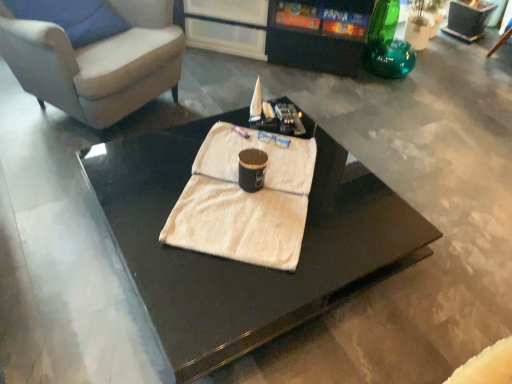
Question: From a real-world perspective, is white textured towel at center under suede-like beige armchair at upper left?

Choices:
 (A) yes
 (B) no

Answer: (A)

Question: Is white textured towel at center closer to the viewer compared to suede-like beige armchair at upper left?

Choices:
 (A) yes
 (B) no

Answer: (A)

Question: From the image's perspective, would you say white textured towel at center is shown under suede-like beige armchair at upper left?

Choices:
 (A) yes
 (B) no

Answer: (A)

Question: Is white textured towel at center oriented away from suede-like beige armchair at upper left?

Choices:
 (A) no
 (B) yes

Answer: (A)

Question: Is white textured towel at center positioned beyond the bounds of suede-like beige armchair at upper left?

Choices:
 (A) yes
 (B) no

Answer: (A)

Question: Considering the relative positions of white textured towel at center and black glossy entertainment center at upper center in the image provided, is white textured towel at center to the left or to the right of black glossy entertainment center at upper center?

Choices:
 (A) right
 (B) left

Answer: (B)

Question: Is point (272, 195) closer or farther from the camera than point (303, 54)?

Choices:
 (A) closer
 (B) farther

Answer: (A)

Question: Is white textured towel at center wider or thinner than black glossy entertainment center at upper center?

Choices:
 (A) thin
 (B) wide

Answer: (A)

Question: Considering the positions of white textured towel at center and black glossy entertainment center at upper center in the image, is white textured towel at center taller or shorter than black glossy entertainment center at upper center?

Choices:
 (A) tall
 (B) short

Answer: (B)

Question: Considering the relative positions of suede-like beige armchair at upper left and black glossy coffee table at center in the image provided, is suede-like beige armchair at upper left to the left or to the right of black glossy coffee table at center?

Choices:
 (A) right
 (B) left

Answer: (B)

Question: Is suede-like beige armchair at upper left taller or shorter than black glossy coffee table at center?

Choices:
 (A) tall
 (B) short

Answer: (A)

Question: In the image, is suede-like beige armchair at upper left positioned in front of or behind black glossy coffee table at center?

Choices:
 (A) front
 (B) behind

Answer: (B)

Question: From the image's perspective, relative to black glossy coffee table at center, is suede-like beige armchair at upper left above or below?

Choices:
 (A) above
 (B) below

Answer: (A)

Question: In terms of width, does black glossy entertainment center at upper center look wider or thinner when compared to black glossy coffee table at center?

Choices:
 (A) wide
 (B) thin

Answer: (B)

Question: Is point (386, 21) positioned closer to the camera than point (212, 119)?

Choices:
 (A) farther
 (B) closer

Answer: (A)